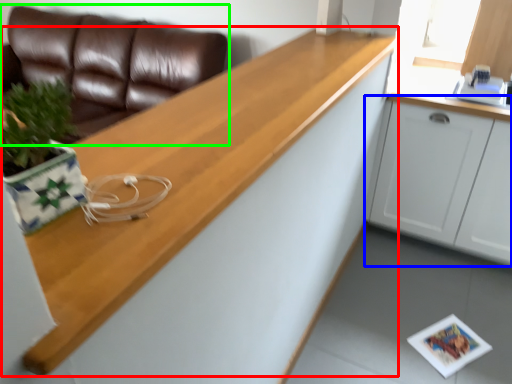
Question: Considering the real-world distances, which object is farthest from countertop (highlighted by a red box)? cabinetry (highlighted by a blue box) or studio couch (highlighted by a green box)?

Choices:
 (A) cabinetry
 (B) studio couch

Answer: (B)